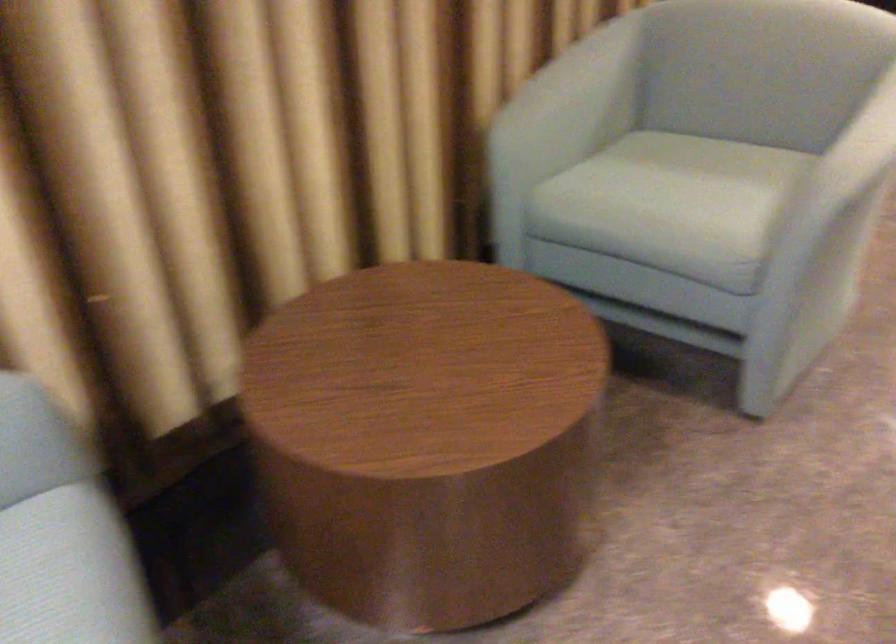
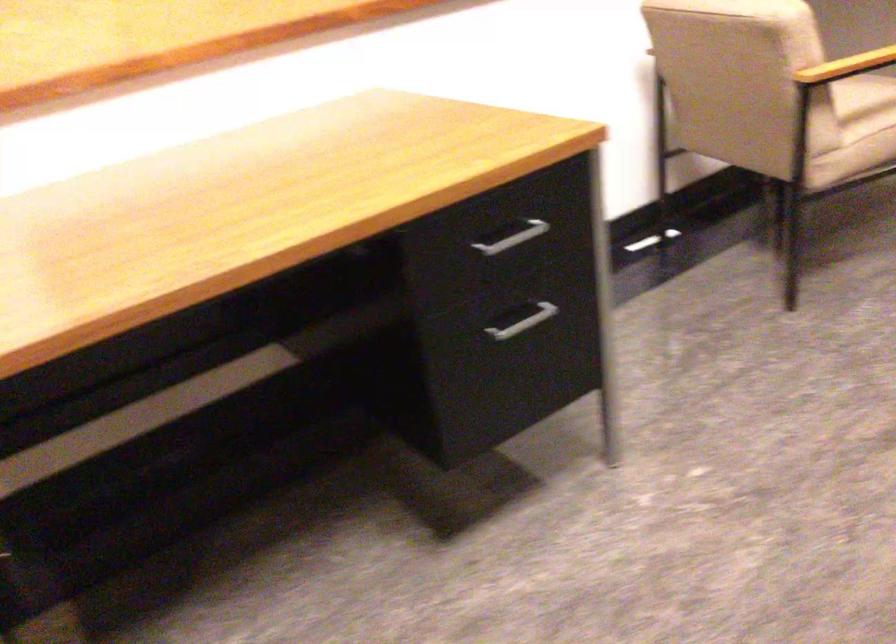
What movement of the cameraman would produce the second image?

The cameraman moved toward right, forward.